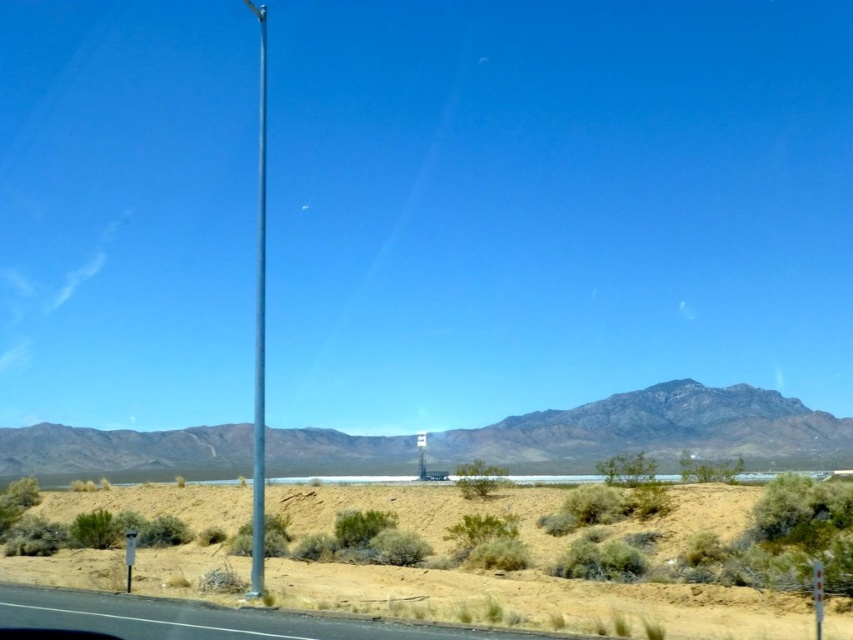
Is clear glass pole at center to the right of metallic rectangular sign at right from the viewer's perspective?

No, clear glass pole at center is not to the right of metallic rectangular sign at right.

This screenshot has width=853, height=640. I want to click on clear glass pole at center, so click(x=259, y=324).

Is black asphalt highway at lower left bigger than clear glass pole at center?

No.

Which is in front, point (151, 634) or point (262, 176)?

Positioned in front is point (151, 634).

Describe the element at coordinates (206, 620) in the screenshot. I see `black asphalt highway at lower left` at that location.

Identify the location of black asphalt highway at lower left. (206, 620).

Who is higher up, rocky brown mountain at center or metallic pole at left?

metallic pole at left is above.

Is point (718, 422) in front of point (129, 568)?

No.

Identify the location of rocky brown mountain at center. This screenshot has width=853, height=640. (654, 429).

The image size is (853, 640). What are the coordinates of `rocky brown mountain at center` in the screenshot? It's located at 654,429.